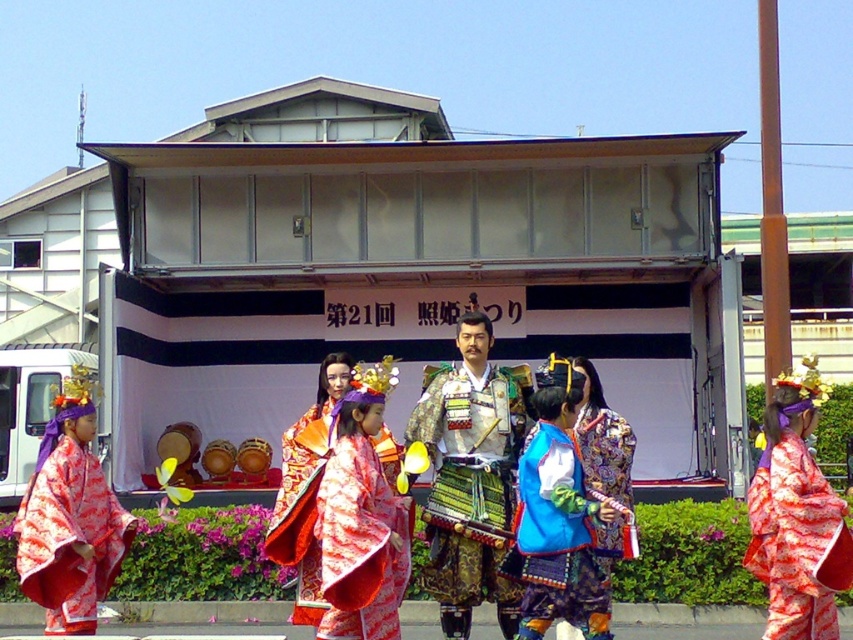
Question: Which point appears farthest from the camera in this image?

Choices:
 (A) [x=485, y=461]
 (B) [x=59, y=468]
 (C) [x=538, y=456]
 (D) [x=300, y=483]

Answer: (A)

Question: Observing the image, what is the correct spatial positioning of matte pink kimono at left in reference to blue satin kimono at center?

Choices:
 (A) below
 (B) above

Answer: (B)

Question: Does green textured armor at center have a lesser width compared to matte pink kimono at left?

Choices:
 (A) no
 (B) yes

Answer: (A)

Question: Is green textured armor at center further to camera compared to matte red kimono at center?

Choices:
 (A) yes
 (B) no

Answer: (A)

Question: Which object appears farthest from the camera in this image?

Choices:
 (A) silky red kimono at center
 (B) green textured armor at center
 (C) matte pink kimono at left

Answer: (B)

Question: Which of the following is the closest to the observer?

Choices:
 (A) blue satin kimono at center
 (B) matte pink kimono at left
 (C) matte red kimono at center

Answer: (A)